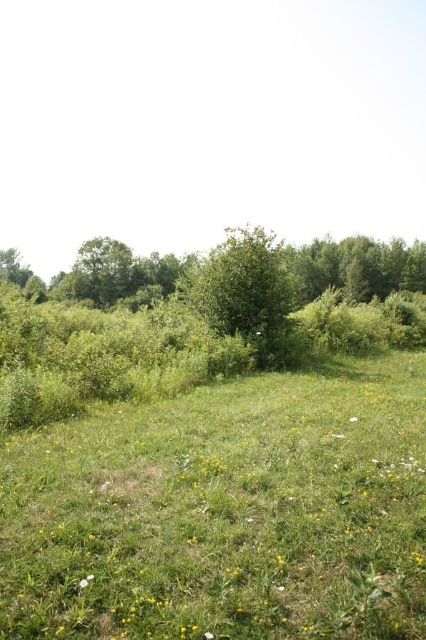
Looking at this image, is green grass at center behind green leafy tree at left?

No, it is in front of green leafy tree at left.

At what (x,y) coordinates should I click in order to perform the action: click on green grass at center. Please return your answer as a coordinate pair (x, y). Looking at the image, I should click on (224, 513).

Who is shorter, green grass at center or green leafy tree at center?

With less height is green grass at center.

This screenshot has height=640, width=426. Describe the element at coordinates (224, 513) in the screenshot. I see `green grass at center` at that location.

Locate an element on the screen. The height and width of the screenshot is (640, 426). green grass at center is located at coordinates (224, 513).

Based on the photo, who is positioned more to the right, green leafy tree at center or green leafy tree at left?

Positioned to the right is green leafy tree at center.

Is green leafy tree at center positioned in front of green leafy tree at left?

Yes, green leafy tree at center is in front of green leafy tree at left.

Which is behind, point (299, 340) or point (118, 248)?

The point (118, 248) is behind.

Image resolution: width=426 pixels, height=640 pixels. What are the coordinates of `green leafy tree at center` in the screenshot? It's located at (247, 294).